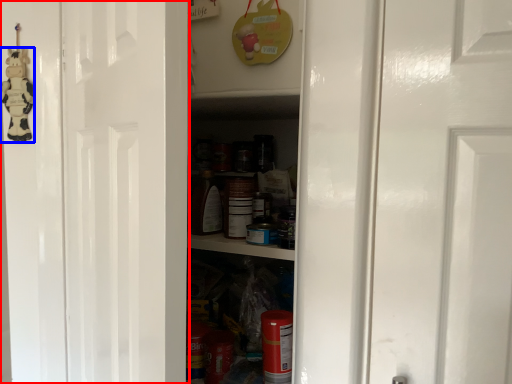
Question: Among these objects, which one is nearest to the camera, door (highlighted by a red box) or toy (highlighted by a blue box)?

Choices:
 (A) door
 (B) toy

Answer: (A)